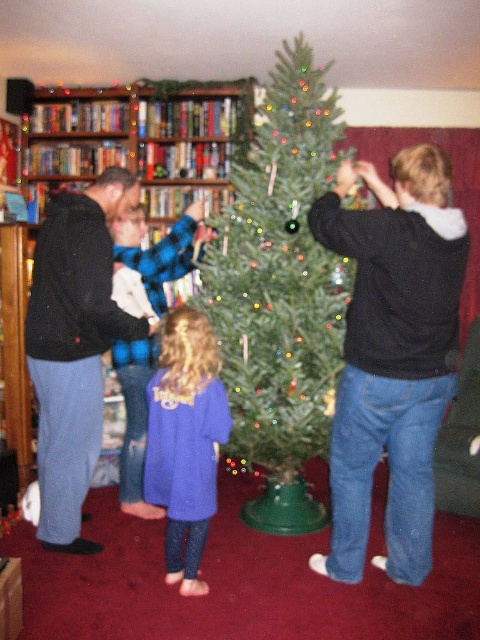
Locate an element on the screen. The height and width of the screenshot is (640, 480). green matte christmas tree at center is located at coordinates (279, 276).

Does green matte christmas tree at center appear on the left side of black hoodie at left?

In fact, green matte christmas tree at center is to the right of black hoodie at left.

Is point (276, 81) closer to viewer compared to point (55, 285)?

No, (276, 81) is behind (55, 285).

The height and width of the screenshot is (640, 480). In order to click on green matte christmas tree at center in this screenshot , I will do `click(279, 276)`.

Does matte black hoodie at center have a smaller size compared to blue fleece sweater at center?

No.

What are the coordinates of `matte black hoodie at center` in the screenshot? It's located at (393, 355).

Locate an element on the screen. Image resolution: width=480 pixels, height=640 pixels. matte black hoodie at center is located at coordinates (393, 355).

From the picture: Is black hoodie at center taller than blue fleece sweater at center?

Yes.

Is black hoodie at center smaller than blue fleece sweater at center?

No, black hoodie at center is not smaller than blue fleece sweater at center.

Between point (346, 228) and point (169, 349), which one is positioned in front?

Positioned in front is point (346, 228).

Where is `black hoodie at center`? The width and height of the screenshot is (480, 640). black hoodie at center is located at coordinates (392, 355).